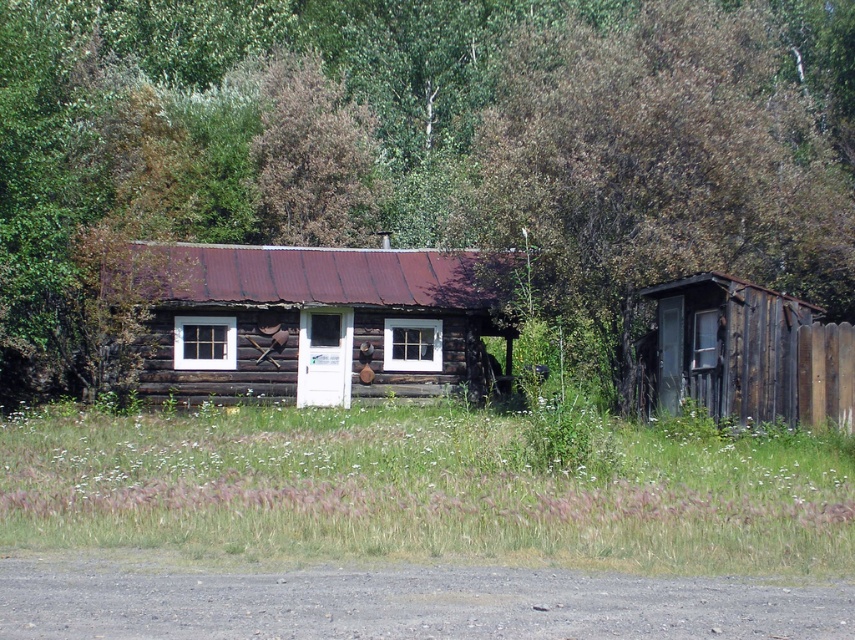
You are standing in front of the rustic log cabin and notice the weathered wood shed at right and the brown wood tree at upper center. Which object is positioned higher in the image?

The brown wood tree at upper center is positioned higher in the image than the weathered wood shed at right.

You are planning to hang a large painting on the brown wood fence at right and the weathered wood shed at right. Which structure will allow the painting to be displayed without needing to adjust its height?

The brown wood fence at right is taller than the weathered wood shed at right, so the painting can be displayed on the brown wood fence at right without needing to adjust its height.

You are standing in front of the cabin and notice a specific point marked at coordinates (420, 148). What object is located at this point?

The brown wood log cabin at center is located at point (420, 148).